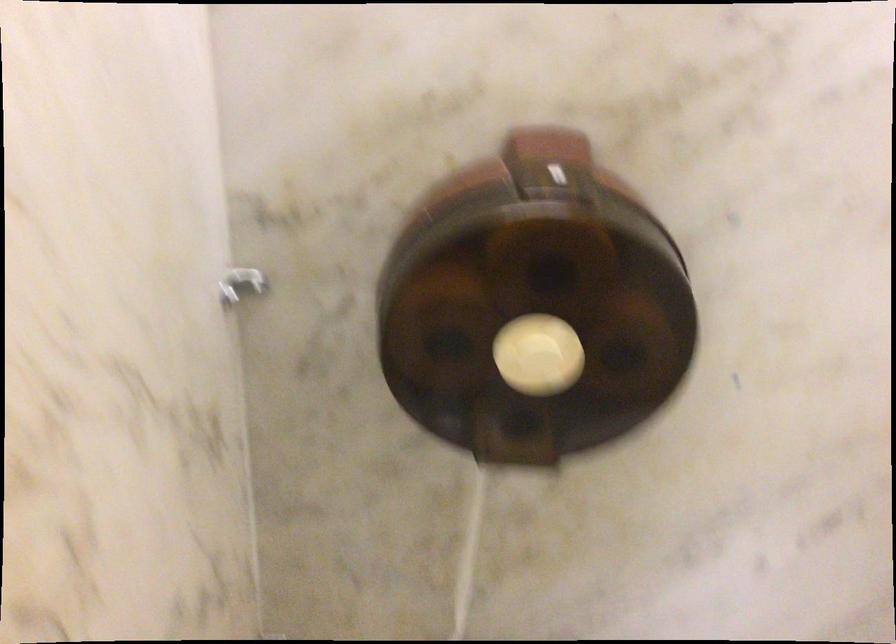
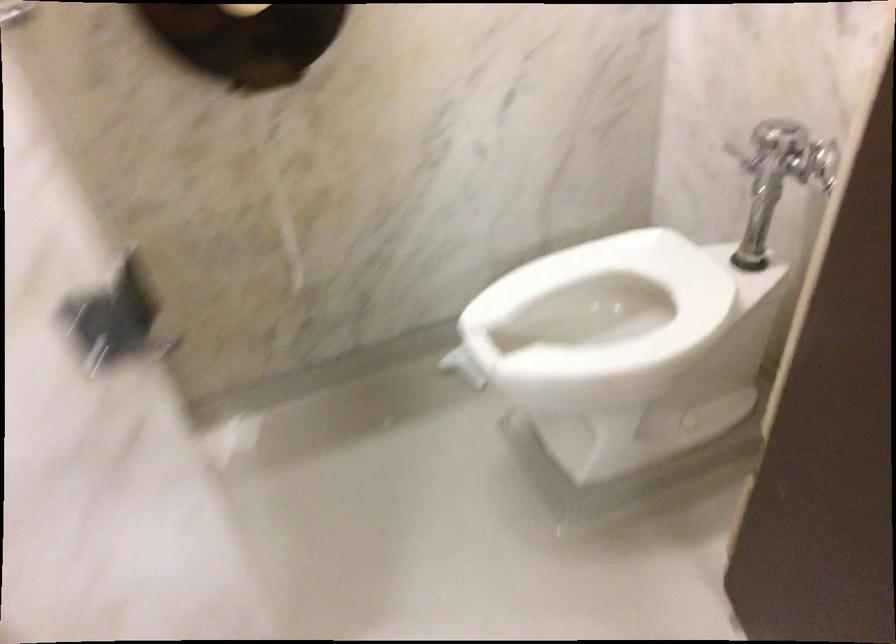
Question: Which direction would the cameraman need to move to produce the second image? Reply with the corresponding letter.

Choices:
 (A) Left
 (B) Right
 (C) Forward
 (D) Backward

Answer: (D)